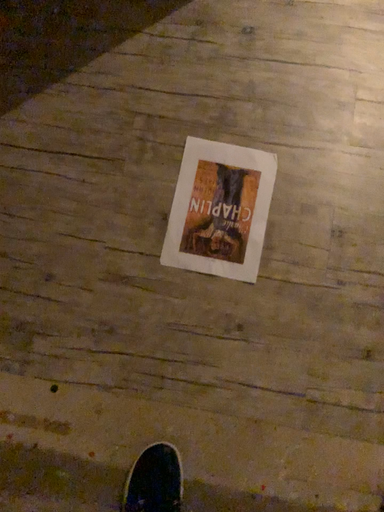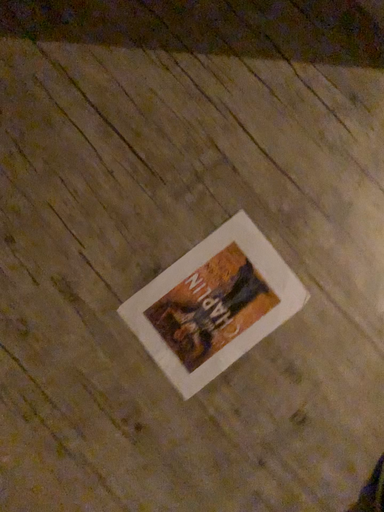
Question: How did the camera likely rotate when shooting the video?

Choices:
 (A) rotated right
 (B) rotated left

Answer: (B)